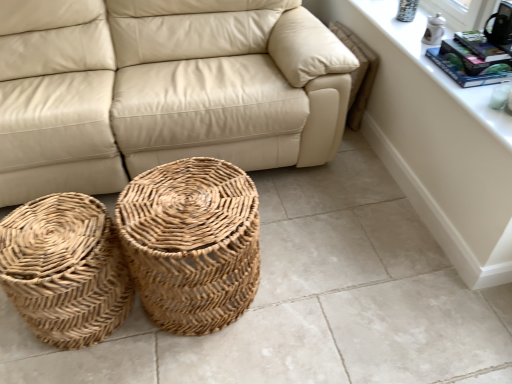
Find the location of a particular element. The height and width of the screenshot is (384, 512). vacant point to the right of natural woven basket at center, which appears as the 1th basket when viewed from the right is located at coordinates (309, 286).